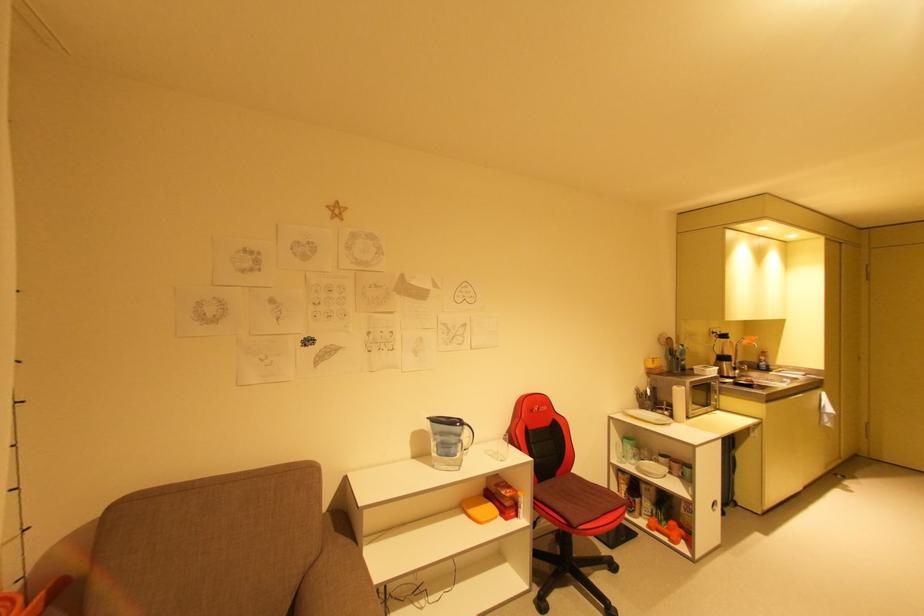
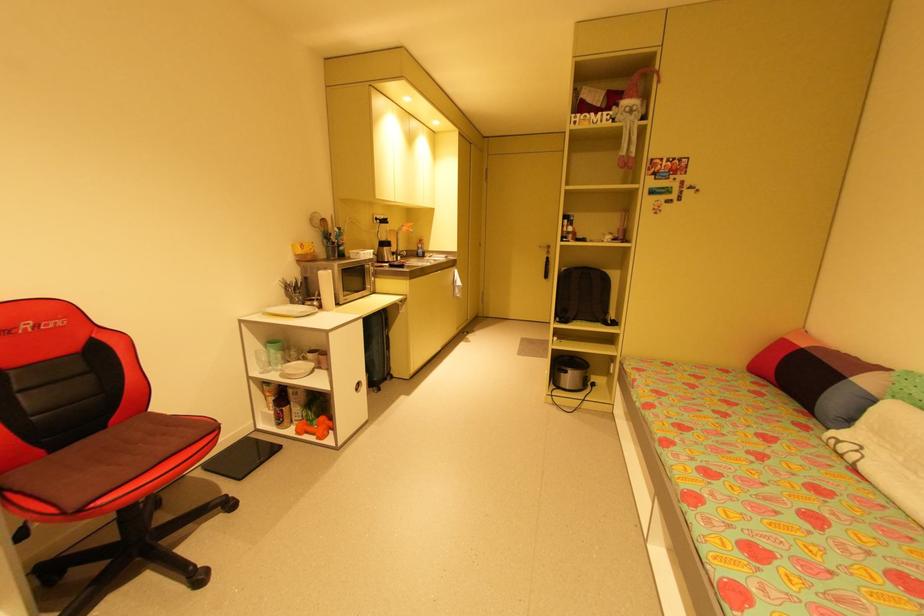
Question: The camera is either moving clockwise (left) or counter-clockwise (right) around the object. The first image is from the beginning of the video and the second image is from the end. Is the camera moving left or right when shooting the video?

Choices:
 (A) Left
 (B) Right

Answer: (A)